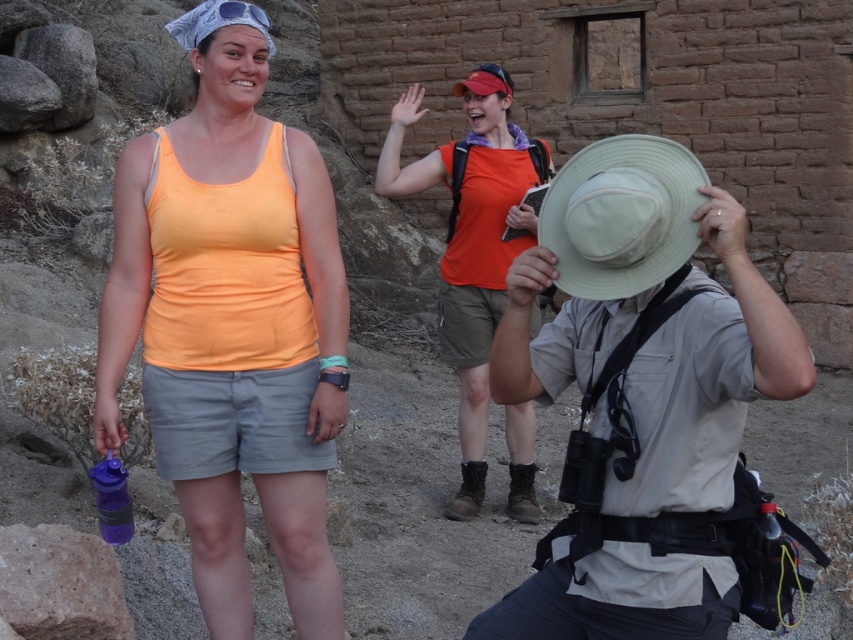
Question: In this image, where is orange fabric shirt at center located relative to light beige straw hat at center?

Choices:
 (A) above
 (B) below

Answer: (B)

Question: Can you confirm if orange fabric shirt at center is positioned above purple translucent water bottle at lower left?

Choices:
 (A) yes
 (B) no

Answer: (A)

Question: Which of the following is the farthest from the observer?

Choices:
 (A) (491, 291)
 (B) (683, 232)

Answer: (A)

Question: Among these points, which one is nearest to the camera?

Choices:
 (A) (100, 477)
 (B) (625, 164)
 (C) (706, 586)

Answer: (C)

Question: Does orange fabric shirt at center come behind purple translucent water bottle at lower left?

Choices:
 (A) no
 (B) yes

Answer: (B)

Question: Which of the following is the closest to the observer?

Choices:
 (A) purple translucent water bottle at lower left
 (B) khaki fabric hat at center
 (C) orange matte tank top at center

Answer: (B)